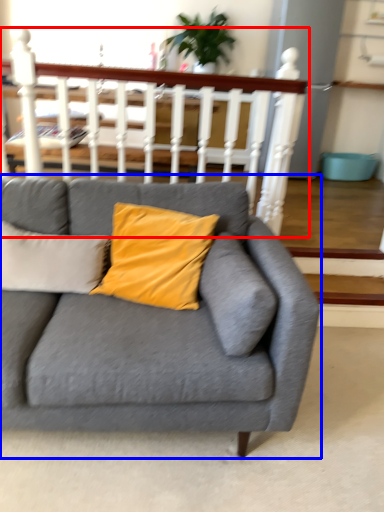
Question: Which object appears farthest to the camera in this image, balustrade (highlighted by a red box) or studio couch (highlighted by a blue box)?

Choices:
 (A) balustrade
 (B) studio couch

Answer: (A)